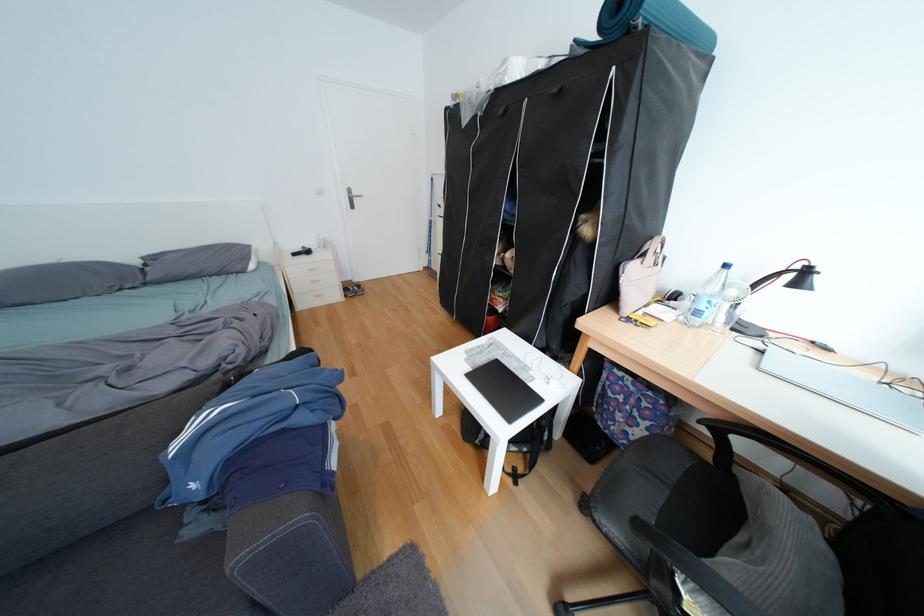
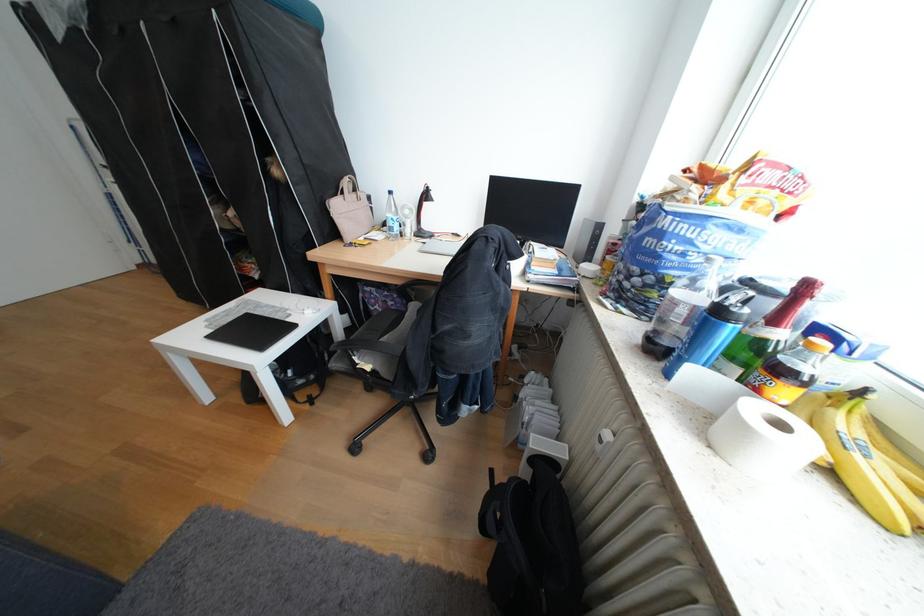
In the second image, find the point that corresponds to (x=657, y=256) in the first image.

(355, 193)